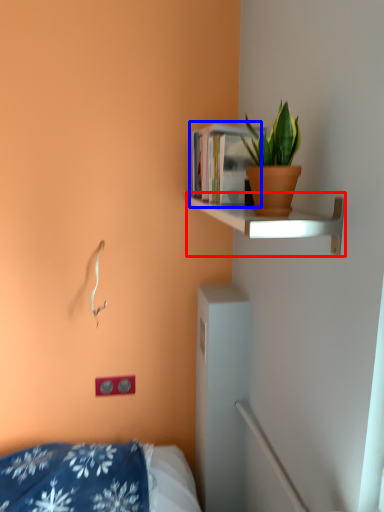
Question: Which point is further to the camera, shelf (highlighted by a red box) or book (highlighted by a blue box)?

Choices:
 (A) shelf
 (B) book

Answer: (B)